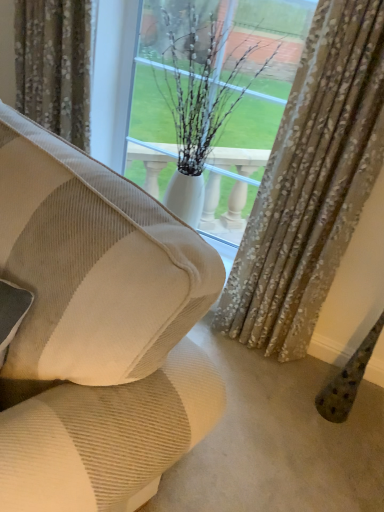
Question: Does beige corduroy couch at center have a smaller size compared to white glossy vase at center?

Choices:
 (A) no
 (B) yes

Answer: (A)

Question: Would you say beige corduroy couch at center is outside white glossy vase at center?

Choices:
 (A) no
 (B) yes

Answer: (B)

Question: Can you confirm if beige corduroy couch at center is bigger than white glossy vase at center?

Choices:
 (A) yes
 (B) no

Answer: (A)

Question: Is beige corduroy couch at center next to white glossy vase at center and touching it?

Choices:
 (A) no
 (B) yes

Answer: (A)

Question: Is beige corduroy couch at center shorter than white glossy vase at center?

Choices:
 (A) yes
 (B) no

Answer: (A)

Question: From the image's perspective, is beige corduroy couch at center below white glossy vase at center?

Choices:
 (A) no
 (B) yes

Answer: (B)

Question: Is patterned fabric curtain at upper center, marked as the 2th curtain in a right-to-left arrangement, positioned in front of textured beige curtain at center, the first curtain from the right?

Choices:
 (A) yes
 (B) no

Answer: (B)

Question: Does patterned fabric curtain at upper center, marked as the 2th curtain in a right-to-left arrangement, have a greater height compared to textured beige curtain at center, the first curtain from the right?

Choices:
 (A) no
 (B) yes

Answer: (A)

Question: From a real-world perspective, is patterned fabric curtain at upper center, marked as the 2th curtain in a right-to-left arrangement, over textured beige curtain at center, the first curtain from the right?

Choices:
 (A) yes
 (B) no

Answer: (A)

Question: Is patterned fabric curtain at upper center, placed as the 1th curtain when sorted from left to right, thinner than textured beige curtain at center, the 2th curtain from the left?

Choices:
 (A) yes
 (B) no

Answer: (B)

Question: Does patterned fabric curtain at upper center, marked as the 2th curtain in a right-to-left arrangement, lie behind textured beige curtain at center, the first curtain from the right?

Choices:
 (A) no
 (B) yes

Answer: (B)

Question: Is patterned fabric curtain at upper center, marked as the 2th curtain in a right-to-left arrangement, at the left side of textured beige curtain at center, the 2th curtain from the left?

Choices:
 (A) yes
 (B) no

Answer: (A)

Question: Considering the relative sizes of white glossy vase at center and textured beige curtain at center, the 2th curtain from the left, in the image provided, is white glossy vase at center bigger than textured beige curtain at center, the 2th curtain from the left,?

Choices:
 (A) yes
 (B) no

Answer: (A)